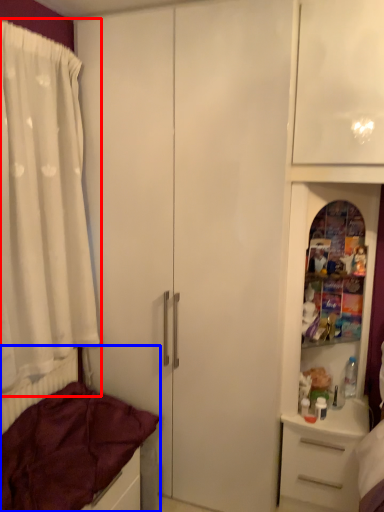
Question: Which point is closer to the camera, curtain (highlighted by a red box) or bed (highlighted by a blue box)?

Choices:
 (A) curtain
 (B) bed

Answer: (B)